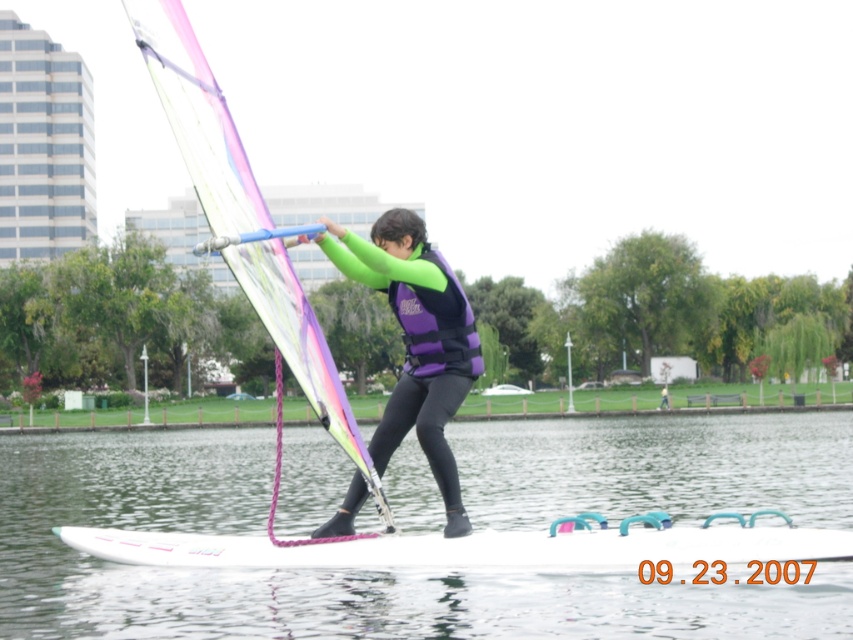
Can you confirm if translucent plastic sail at center is shorter than purple matte life jacket at center?

Incorrect, translucent plastic sail at center's height does not fall short of purple matte life jacket at center's.

Does translucent plastic sail at center have a larger size compared to purple matte life jacket at center?

Yes.

Who is more forward, (189,38) or (422,316)?

Point (422,316) is in front.

The image size is (853, 640). Find the location of `translucent plastic sail at center`. translucent plastic sail at center is located at coordinates (242, 218).

Who is lower down, translucent plastic sail at center or purple neoprene wetsuit at center?

purple neoprene wetsuit at center is below.

Between point (241, 248) and point (662, 406), which one is positioned behind?

Point (662, 406)

The image size is (853, 640). I want to click on translucent plastic sail at center, so click(x=242, y=218).

Between point (674, 540) and point (426, 312), which one is positioned behind?

The point (426, 312) is behind.

Is white glossy surfboard at center shorter than purple matte life jacket at center?

Yes.

Identify the location of white glossy surfboard at center. (473, 548).